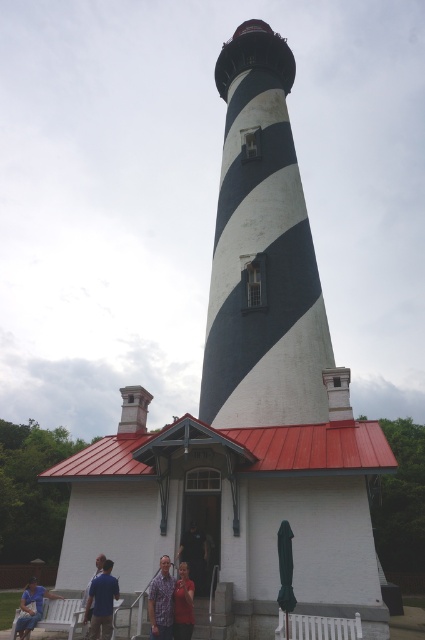
You are standing at the entrance of the lighthouse and want to reach both the point at coordinates point (x=184, y=545) and point (x=33, y=614). Which point will you encounter first as you walk straight ahead?

You will encounter point (x=184, y=545) first because it is closer to you than point (x=33, y=614), which is further away.

You are a photographer planning to take a group photo of the printed cotton shirt at lower center and the light brown wood shirt at center. Which of the two shirts should you focus on first if you want to include both in the frame without moving the camera?

You should focus on the printed cotton shirt at lower center first because it is larger in size than the light brown wood shirt at center, making it more prominent in the frame.

You are standing at the entrance of the lighthouse and see the printed cotton shirt at lower center and the light brown wood shirt at center. Which shirt is closer to you?

The printed cotton shirt at lower center is closer to you because the light brown wood shirt at center is behind it.